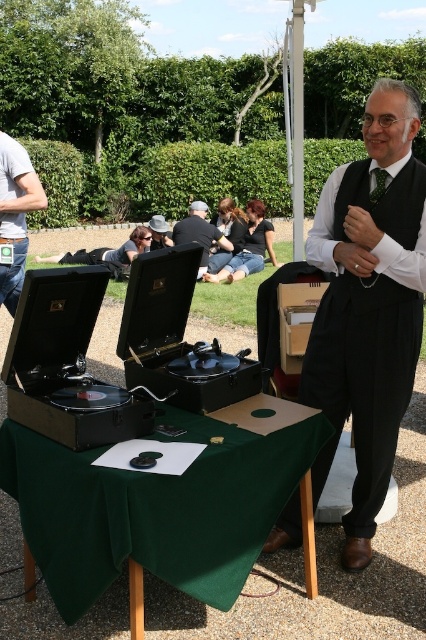
Is green fabric table at center positioned in front of dark gray suit at center?

Yes, it is in front of dark gray suit at center.

Identify the location of green fabric table at center. (155, 508).

What do you see at coordinates (155, 508) in the screenshot? I see `green fabric table at center` at bounding box center [155, 508].

Which is behind, point (236, 464) or point (34, 176)?

Point (34, 176)

You are a GUI agent. You are given a task and a screenshot of the screen. Output one action in this format:
    pyautogui.click(x=<x>, y=<y>)
    Task: Click on the green fabric table at center
    The height and width of the screenshot is (640, 426).
    Given the screenshot: What is the action you would take?
    pyautogui.click(x=155, y=508)

Between light blue t-shirt at left and dark gray suit at center, which one has more height?

dark gray suit at center

Is light blue t-shirt at left thinner than dark gray suit at center?

Indeed, light blue t-shirt at left has a lesser width compared to dark gray suit at center.

You are a GUI agent. You are given a task and a screenshot of the screen. Output one action in this format:
    pyautogui.click(x=<x>, y=<y>)
    Task: Click on the light blue t-shirt at left
    The image size is (426, 640).
    Given the screenshot: What is the action you would take?
    pyautogui.click(x=16, y=214)

I want to click on light blue t-shirt at left, so click(x=16, y=214).